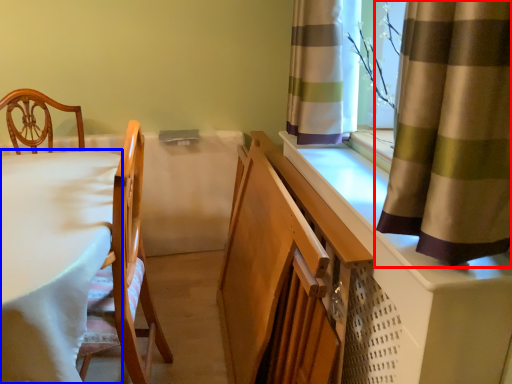
Question: Which object appears farthest to the camera in this image, curtain (highlighted by a red box) or table (highlighted by a blue box)?

Choices:
 (A) curtain
 (B) table

Answer: (B)